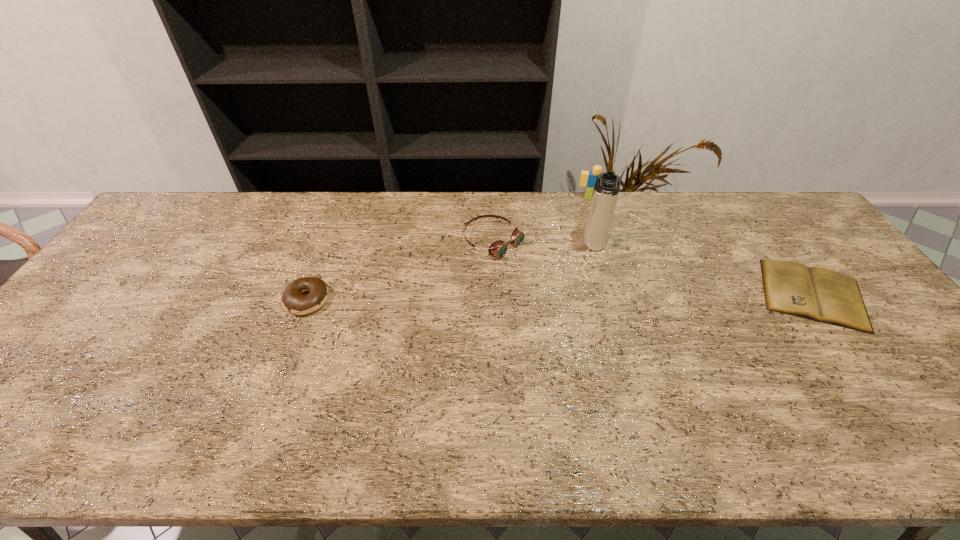
The image size is (960, 540). I want to click on the leftmost object, so click(x=293, y=301).

The image size is (960, 540). Identify the location of doughnut. (293, 301).

Find the location of a particular element. This screenshot has width=960, height=540. the rightmost object is located at coordinates (820, 294).

At what (x,y) coordinates should I click in order to perform the action: click on book. Please return your answer as a coordinate pair (x, y). This screenshot has height=540, width=960. Looking at the image, I should click on (820, 294).

The width and height of the screenshot is (960, 540). Identify the location of the tallest object. (606, 190).

Where is `goggles`? goggles is located at coordinates pyautogui.click(x=499, y=248).

Locate an element on the screen. This screenshot has height=540, width=960. the second object from left to right is located at coordinates (499, 248).

Where is `Lego`? This screenshot has height=540, width=960. Lego is located at coordinates (588, 179).

The width and height of the screenshot is (960, 540). Find the location of `the second tallest object`. the second tallest object is located at coordinates (588, 179).

You are a GUI agent. You are given a task and a screenshot of the screen. Output one action in this format:
    pyautogui.click(x=<x>, y=<y>)
    Task: Click on the vacant space located 0.390m on the left of the fourth tallest object
    This screenshot has height=540, width=960.
    Given the screenshot: What is the action you would take?
    pyautogui.click(x=142, y=300)